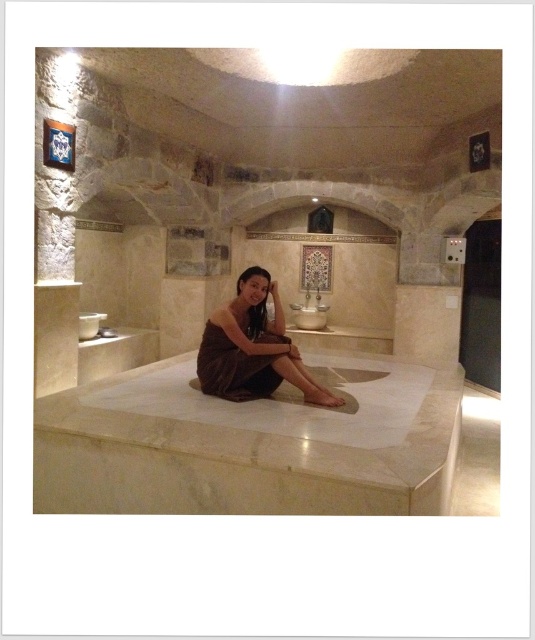
You are a guest in the Turkish bathhouse and need to place your brown satin dress at center on the white marble bathtub at center. Can you do this without any issues?

The white marble bathtub at center is taller than brown satin dress at center, so you can place the brown satin dress at center on top of the white marble bathtub at center without any issues.

You are a visitor in the hamam and see both the brown fabric at center and the brown satin dress at center. Which object is positioned higher in the scene?

The brown fabric at center is taller than the brown satin dress at center, so the brown fabric at center is positioned higher in the scene.